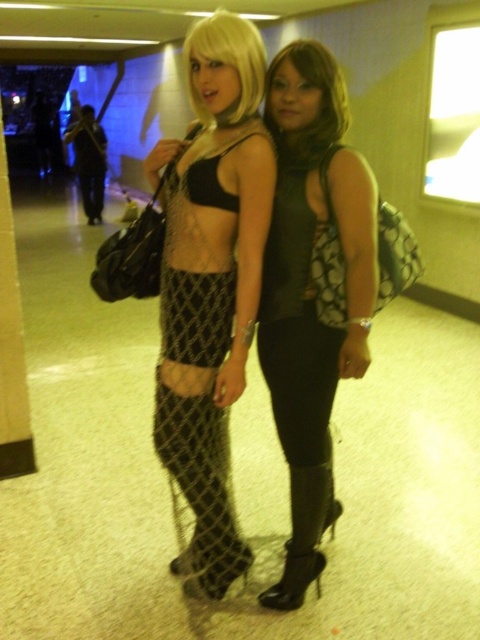
You are a fashion designer observing the two individuals in the image. You need to determine which of the two items, the matte black mesh skirt at center or the matte black top at center, has a greater horizontal spread when viewed from the front. Which one is wider?

The matte black mesh skirt at center has a greater horizontal spread than the matte black top at center because its width is larger.

You are a fashion designer observing the two individuals in the image. You notice the matte black mesh skirt at center and the matte black top at center. Which of these two items is positioned higher on the person?

The matte black mesh skirt at center is positioned higher on the person than the matte black top at center because it is described as being above it.